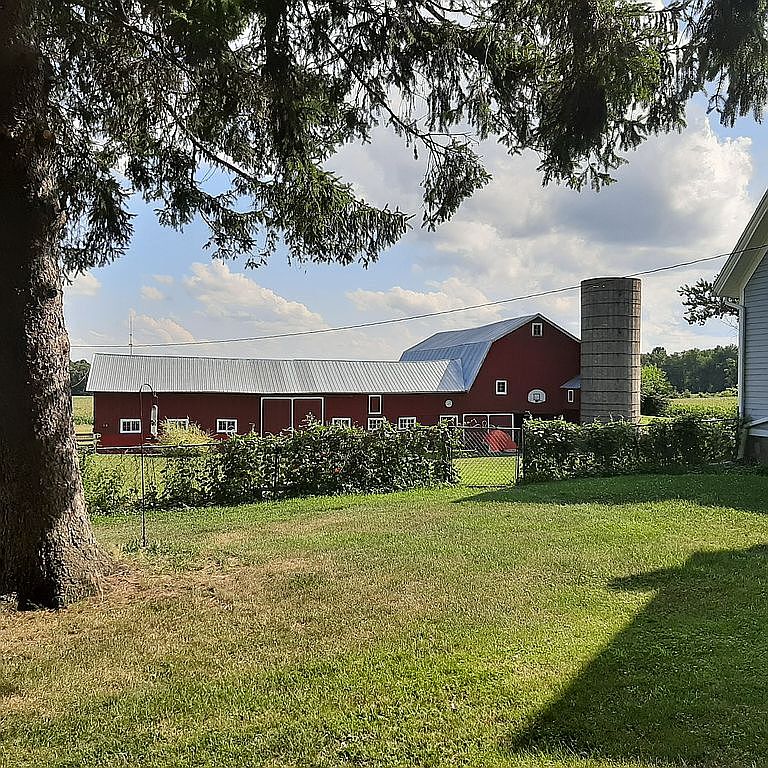
Find the location of a particular element. The height and width of the screenshot is (768, 768). windows is located at coordinates (223, 424), (126, 425), (177, 424), (341, 422), (375, 422), (402, 424), (502, 391), (538, 329), (452, 421).